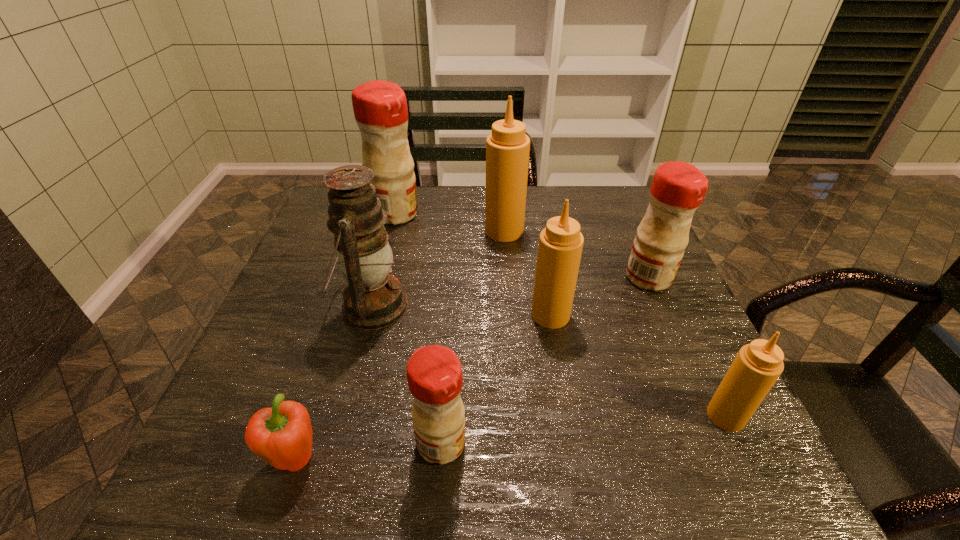
What are the coordinates of `object that stands as the second closest to the third farthest condiment` in the screenshot? It's located at (507, 148).

The image size is (960, 540). Find the location of `condiment that can be found as the third closest to the farthest tan condiment`. condiment that can be found as the third closest to the farthest tan condiment is located at coordinates (678, 188).

At what (x,y) coordinates should I click in order to perform the action: click on condiment that is the closest to the smallest red condiment. Please return your answer as a coordinate pair (x, y). Image resolution: width=960 pixels, height=540 pixels. Looking at the image, I should click on (560, 246).

This screenshot has height=540, width=960. In order to click on the closest tan condiment to the second smallest tan condiment in this screenshot , I will do `click(507, 148)`.

The width and height of the screenshot is (960, 540). What are the coordinates of `tan condiment that is the closest to the lantern` in the screenshot? It's located at (507, 148).

This screenshot has height=540, width=960. I want to click on red condiment that is the third closest to the biggest tan condiment, so click(x=434, y=373).

Select which red condiment appears as the second closest to the rightmost red condiment. Please provide its 2D coordinates. Your answer should be formatted as a tuple, i.e. [(x, y)], where the tuple contains the x and y coordinates of a point satisfying the conditions above.

[(380, 108)]

Find the location of a particular element. free location that satisfies the following two spatial constraints: 1. on the front side of the farthest tan condiment; 2. on the left side of the second smallest tan condiment is located at coordinates (511, 315).

At what (x,y) coordinates should I click in order to perform the action: click on vacant space that satisfies the following two spatial constraints: 1. on the back side of the smallest tan condiment; 2. on the right side of the orange pepper. Please return your answer as a coordinate pair (x, y). Looking at the image, I should click on (308, 416).